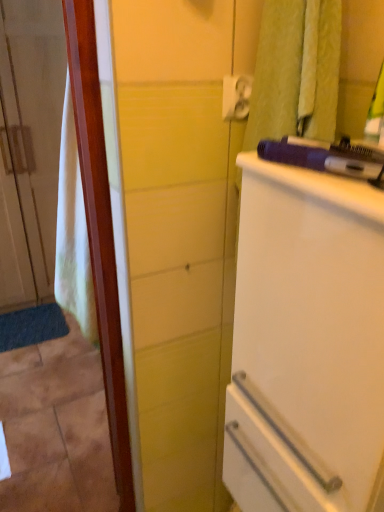
Question: Which is correct: white plastic towel bar at upper right is inside purple plastic hairdryer at upper right, or outside of it?

Choices:
 (A) inside
 (B) outside

Answer: (B)

Question: Considering the positions of point (233, 111) and point (246, 154), is point (233, 111) closer or farther from the camera than point (246, 154)?

Choices:
 (A) farther
 (B) closer

Answer: (B)

Question: Estimate the real-world distances between objects in this image. Which object is farther from the white glossy refrigerator at right?

Choices:
 (A) white fabric door at left
 (B) purple plastic hairdryer at upper right
 (C) white plastic towel bar at upper right

Answer: (A)

Question: Which object is positioned farthest from the white fabric door at left?

Choices:
 (A) purple plastic hairdryer at upper right
 (B) white plastic towel bar at upper right
 (C) white glossy refrigerator at right

Answer: (A)